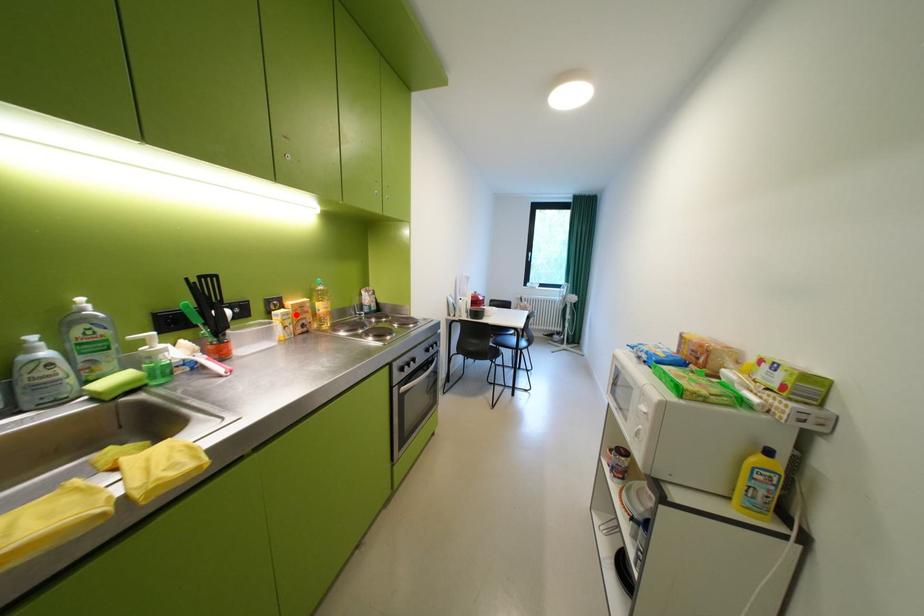
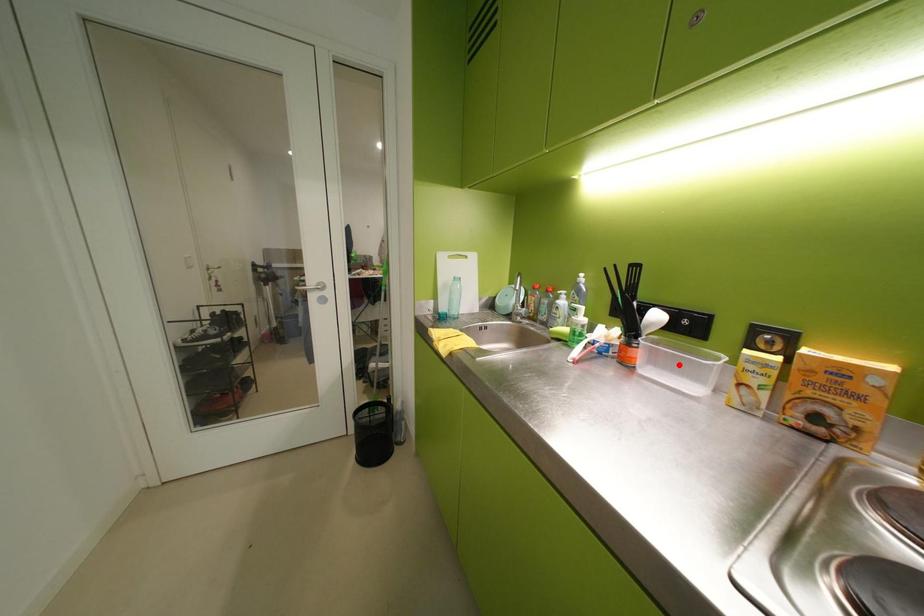
I am providing you with two images of the same scene from different viewpoints. A red point is marked on the first image and another point is marked on the second image. Do the highlighted points in image1 and image2 indicate the same real-world spot?

No